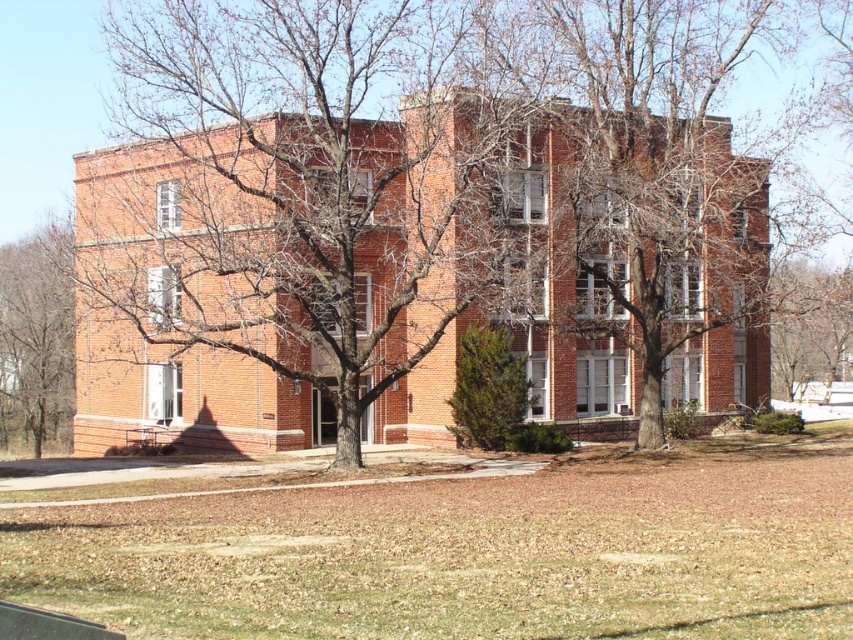
Can you confirm if brown bark tree at center is wider than bare branches at left?

Yes, brown bark tree at center is wider than bare branches at left.

From the picture: Who is more forward, (397,88) or (68,369)?

Point (68,369)

Identify the location of brown bark tree at center. The image size is (853, 640). (299, 189).